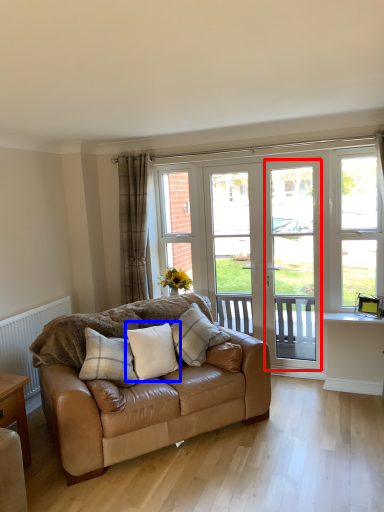
Question: Which object appears closest to the camera in this image, screen door (highlighted by a red box) or pillow (highlighted by a blue box)?

Choices:
 (A) screen door
 (B) pillow

Answer: (B)